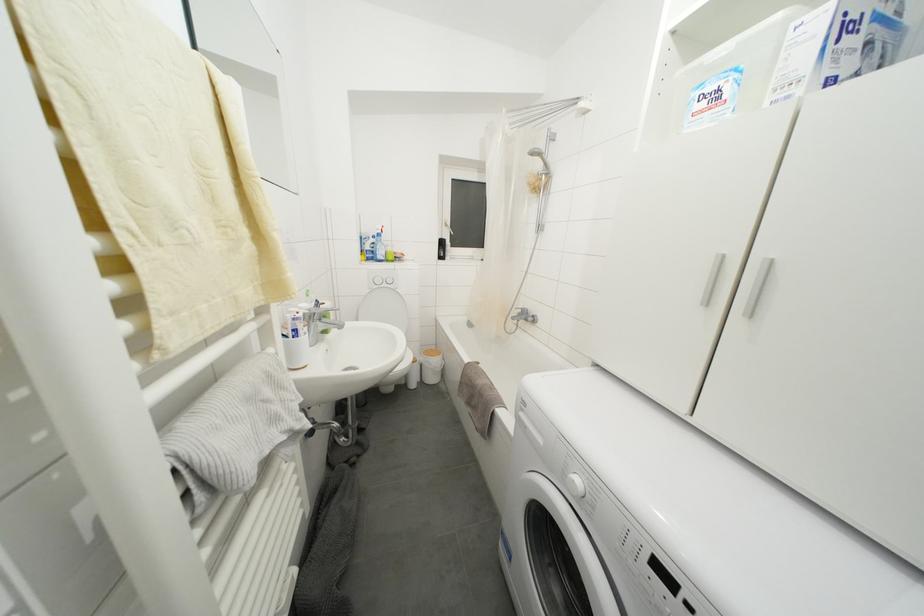
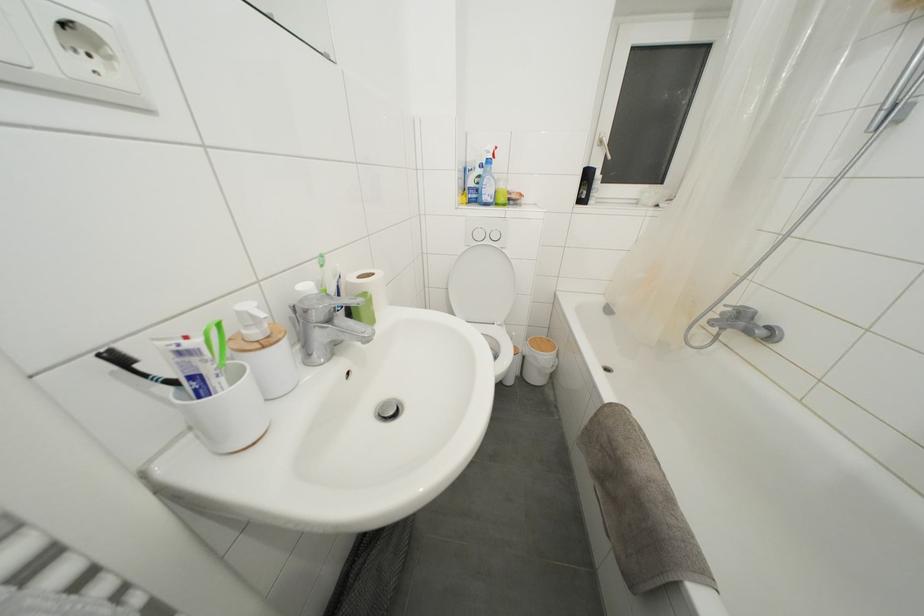
Locate, in the second image, the point that corresponds to [383,262] in the first image.

(490, 203)